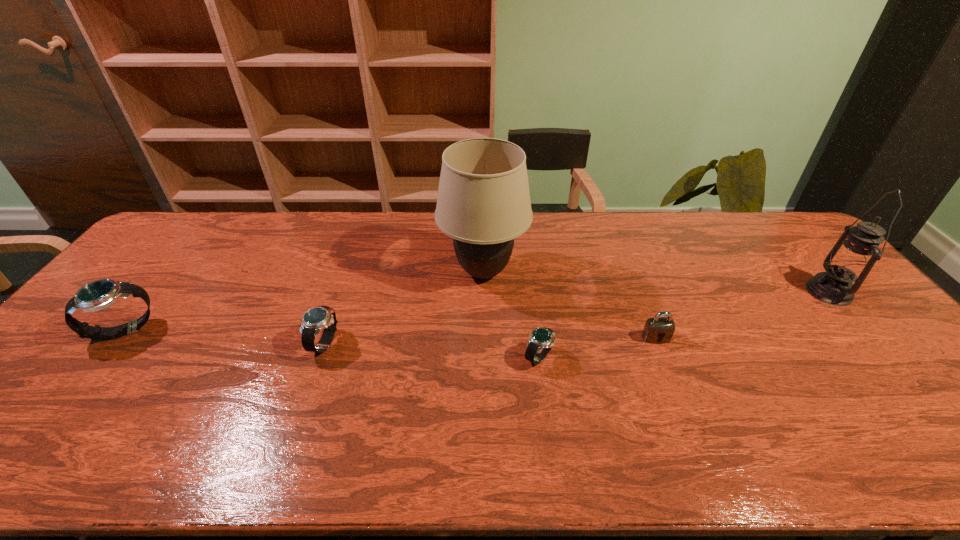
This screenshot has height=540, width=960. What are the coordinates of `vacant space located on the left of the fifth object from right to left` in the screenshot? It's located at (287, 343).

What are the coordinates of `vacant space located on the right of the rightmost watch` in the screenshot? It's located at (681, 357).

Image resolution: width=960 pixels, height=540 pixels. In order to click on free location located 0.350m on the back of the rightmost object in this screenshot , I will do `click(761, 214)`.

I want to click on free spot located 0.270m on the right of the lampshade, so click(614, 273).

Image resolution: width=960 pixels, height=540 pixels. I want to click on vacant space located 0.060m at the front of the second object from right to left near the keyhole, so click(665, 362).

Locate an element on the screen. The height and width of the screenshot is (540, 960). object that is at the far edge is located at coordinates (483, 203).

Identify the location of object that is at the left edge. (100, 294).

Find the location of a particular element. The height and width of the screenshot is (540, 960). object situated at the right edge is located at coordinates (851, 260).

Locate an element on the screen. This screenshot has width=960, height=540. vacant space at the far edge of the desktop is located at coordinates (684, 225).

Where is `blank space at the near edge of the desktop`? The image size is (960, 540). blank space at the near edge of the desktop is located at coordinates (231, 408).